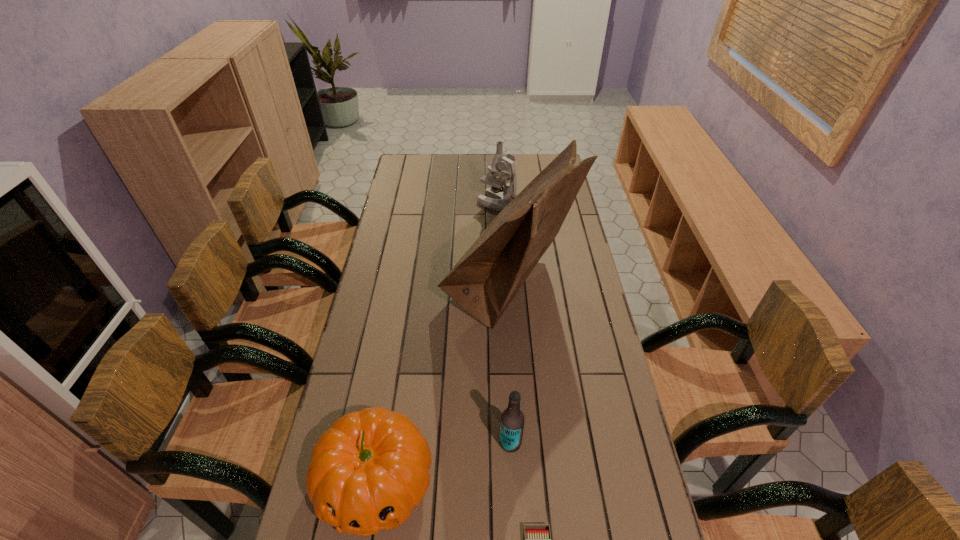
Image resolution: width=960 pixels, height=540 pixels. I want to click on object that is at the right edge, so click(x=485, y=280).

Find the location of a particular element. vacant space at the left edge of the desktop is located at coordinates (374, 395).

Where is `free space at the right edge`? This screenshot has width=960, height=540. free space at the right edge is located at coordinates (569, 255).

This screenshot has height=540, width=960. Find the location of `free space at the far left corner of the desktop`. free space at the far left corner of the desktop is located at coordinates (432, 156).

Locate an element on the screen. free spot between the beer bottle and the fourth shortest object is located at coordinates [x=504, y=323].

Where is `vacant space that is in between the microscope and the beer bottle`? This screenshot has height=540, width=960. vacant space that is in between the microscope and the beer bottle is located at coordinates (504, 323).

Locate an element on the screen. This screenshot has height=540, width=960. vacant area that lies between the beer bottle and the fourth shortest object is located at coordinates (504, 323).

Locate an element on the screen. The height and width of the screenshot is (540, 960). object that can be found as the third closest to the tallest object is located at coordinates (512, 419).

Locate an element on the screen. The width and height of the screenshot is (960, 540). the fourth closest object relative to the grocery bag is located at coordinates (537, 539).

This screenshot has height=540, width=960. I want to click on vacant area that satisfies the following two spatial constraints: 1. on the front side of the tallest object; 2. on the left side of the farthest object, so click(x=502, y=291).